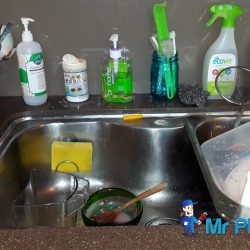
Image resolution: width=250 pixels, height=250 pixels. I want to click on bowl, so click(135, 220).